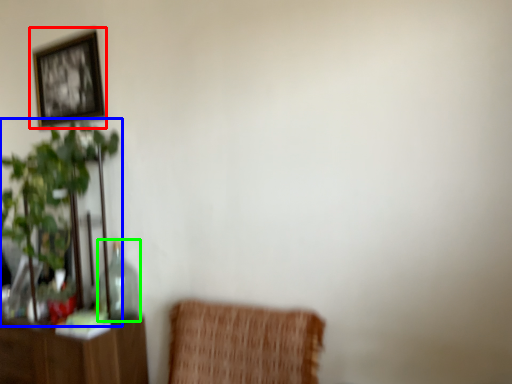
Question: Considering the real-world distances, which object is closest to picture frame (highlighted by a red box)? houseplant (highlighted by a blue box) or glass vase (highlighted by a green box).

Choices:
 (A) houseplant
 (B) glass vase

Answer: (A)